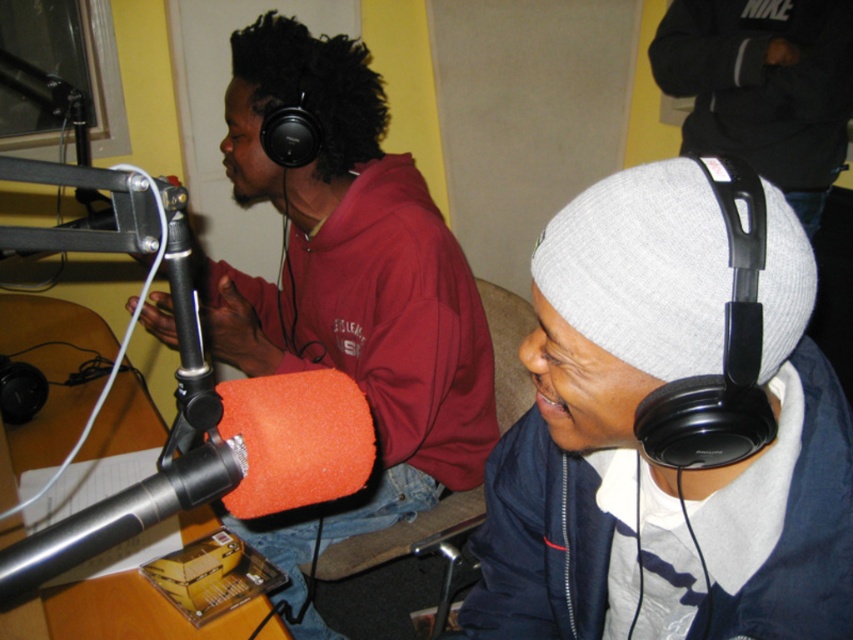
Which is in front, point (294, 586) or point (105, 545)?

Point (105, 545)

Is matte black headphones at left smaller than orange foam microphone at center?

No.

Who is more forward, (x=380, y=205) or (x=236, y=449)?

Point (x=236, y=449)

Where is `matte black headphones at left`? The height and width of the screenshot is (640, 853). matte black headphones at left is located at coordinates (350, 292).

Between point (610, 186) and point (126, 496), which one is positioned behind?

The point (610, 186) is more distant.

Does gray knit beanie at upper right have a greater height compared to orange foam microphone at center?

A: Yes, gray knit beanie at upper right is taller than orange foam microphone at center.

Is point (674, 195) farther from viewer compared to point (247, 474)?

Yes.

Locate an element on the screen. The image size is (853, 640). gray knit beanie at upper right is located at coordinates (596, 400).

Does gray knit beanie at upper right lie behind matte black headphones at left?

No, it is not.

Consider the image. Does gray knit beanie at upper right appear under matte black headphones at left?

Yes, gray knit beanie at upper right is below matte black headphones at left.

The height and width of the screenshot is (640, 853). Describe the element at coordinates (596, 400) in the screenshot. I see `gray knit beanie at upper right` at that location.

Find the location of a particular element. gray knit beanie at upper right is located at coordinates (596, 400).